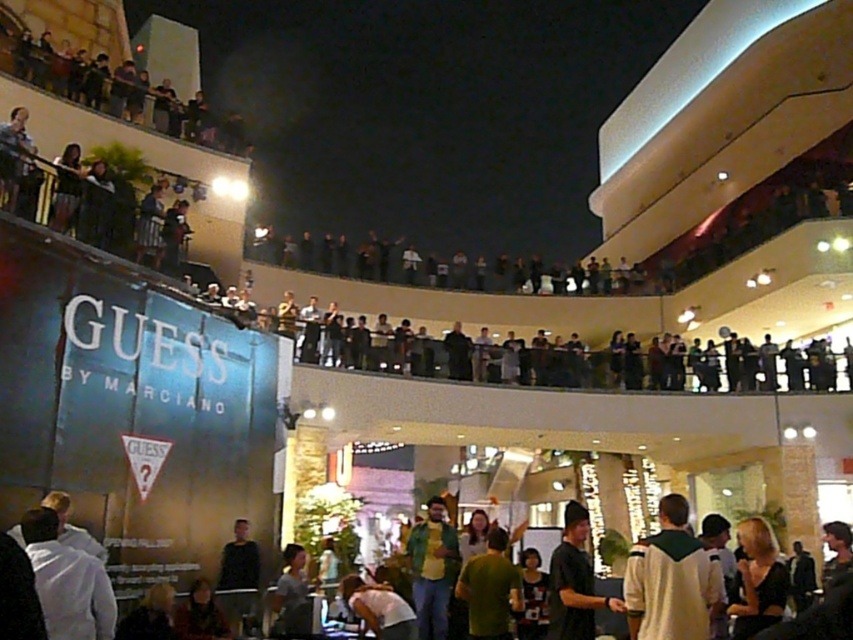
Is white fleece jacket at lower right further to camera compared to green shirt at center?

Yes, white fleece jacket at lower right is behind green shirt at center.

Does white fleece jacket at lower right have a smaller size compared to green shirt at center?

Yes, white fleece jacket at lower right is smaller than green shirt at center.

Measure the distance between point (680, 586) and camera.

Point (680, 586) and camera are 99.51 feet apart from each other.

I want to click on white fleece jacket at lower right, so click(671, 579).

Who is lower down, green textured shirt at center or green matte shirt at center?

green textured shirt at center

Looking at this image, can you confirm if green textured shirt at center is positioned below green matte shirt at center?

Indeed, green textured shirt at center is positioned under green matte shirt at center.

The height and width of the screenshot is (640, 853). What do you see at coordinates (432, 570) in the screenshot?
I see `green textured shirt at center` at bounding box center [432, 570].

Locate an element on the screen. The image size is (853, 640). green textured shirt at center is located at coordinates (432, 570).

Can you confirm if dark gray t-shirt at center is taller than green matte shirt at center?

Correct, dark gray t-shirt at center is much taller as green matte shirt at center.

Which is behind, point (548, 620) or point (494, 570)?

The point (494, 570) is more distant.

Who is more distant from viewer, (550, 557) or (479, 561)?

The point (550, 557) is behind.

You are a GUI agent. You are given a task and a screenshot of the screen. Output one action in this format:
    pyautogui.click(x=<x>, y=<y>)
    Task: Click on the dark gray t-shirt at center
    Image resolution: width=853 pixels, height=640 pixels.
    Given the screenshot: What is the action you would take?
    coord(573,580)